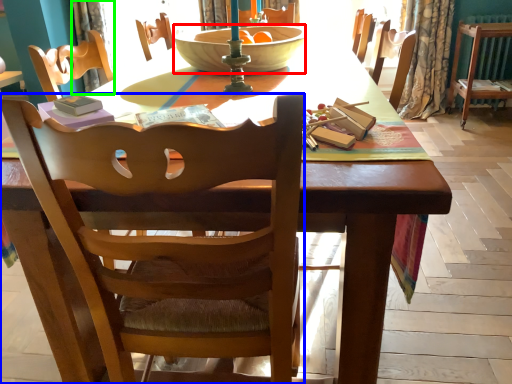
Question: Estimate the real-world distances between objects in this image. Which object is closer to bowl (highlighted by a red box), chair (highlighted by a blue box) or curtain (highlighted by a green box)?

Choices:
 (A) chair
 (B) curtain

Answer: (A)